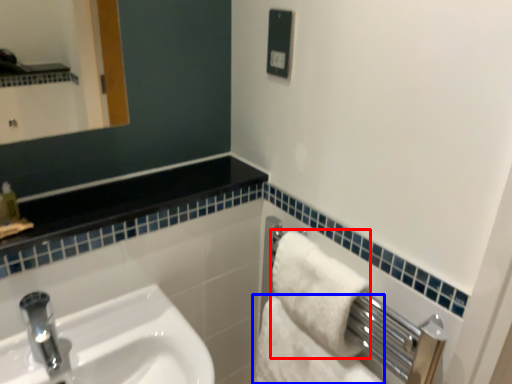
Question: Which point is further to the camera, bath towel (highlighted by a red box) or bath towel (highlighted by a blue box)?

Choices:
 (A) bath towel
 (B) bath towel

Answer: (B)